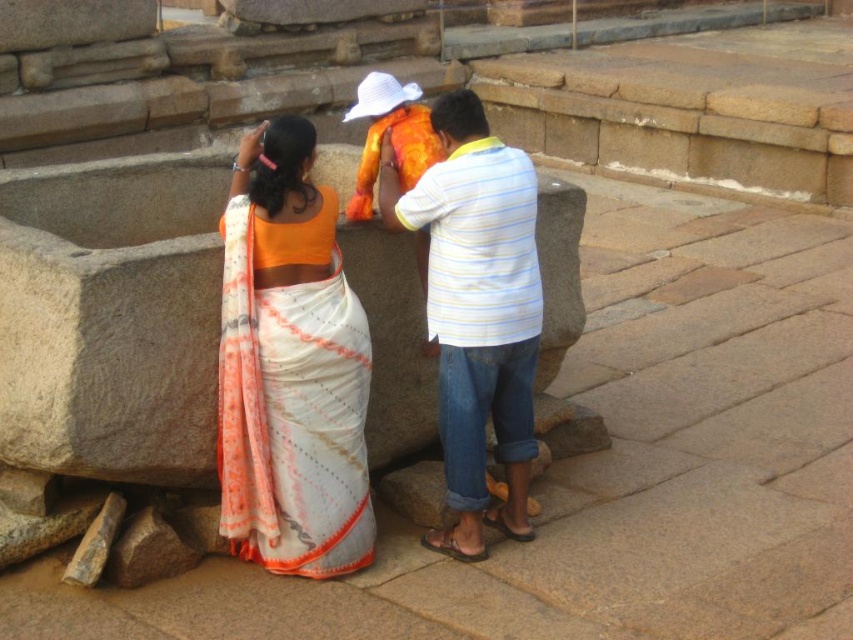
Which is above, orange cotton saree at center or white striped shirt at center?

white striped shirt at center is higher up.

Which is in front, point (242, 460) or point (498, 380)?

Point (242, 460)

What are the coordinates of `orange cotton saree at center` in the screenshot? It's located at (289, 369).

Can you confirm if orange cotton saree at center is positioned above white silk saree at center?

No.

Between orange cotton saree at center and white silk saree at center, which one is positioned lower?

orange cotton saree at center is lower down.

Who is more distant from viewer, (225, 272) or (299, 264)?

Positioned behind is point (299, 264).

This screenshot has height=640, width=853. I want to click on orange cotton saree at center, so click(289, 369).

This screenshot has height=640, width=853. In order to click on white silk saree at center in this screenshot , I will do `click(289, 368)`.

Which of these two, white silk saree at center or white striped shirt at center, stands taller?

white striped shirt at center is taller.

In order to click on white silk saree at center in this screenshot , I will do `click(289, 368)`.